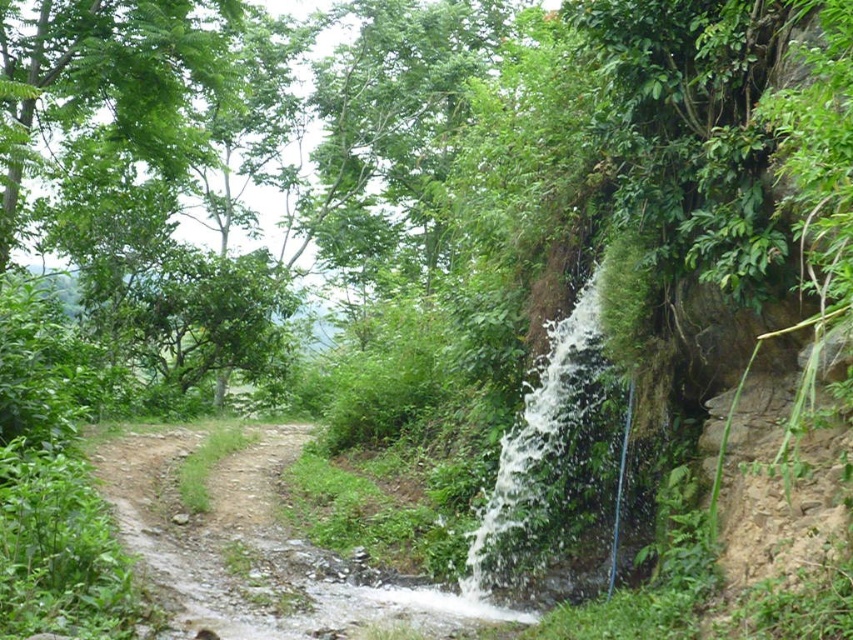
Question: Can you confirm if green leafy tree at upper left is positioned to the left of white frothy water at right?

Choices:
 (A) no
 (B) yes

Answer: (B)

Question: Among these objects, which one is nearest to the camera?

Choices:
 (A) green leafy tree at upper left
 (B) white frothy water at right

Answer: (B)

Question: Which of the following is the closest to the observer?

Choices:
 (A) (625, 428)
 (B) (107, 266)

Answer: (A)

Question: Among these objects, which one is farthest from the camera?

Choices:
 (A) green leafy tree at upper left
 (B) white frothy water at right

Answer: (A)

Question: Does green leafy tree at upper left have a larger size compared to white frothy water at right?

Choices:
 (A) yes
 (B) no

Answer: (A)

Question: Is the position of green leafy tree at upper left more distant than that of white frothy water at right?

Choices:
 (A) no
 (B) yes

Answer: (B)